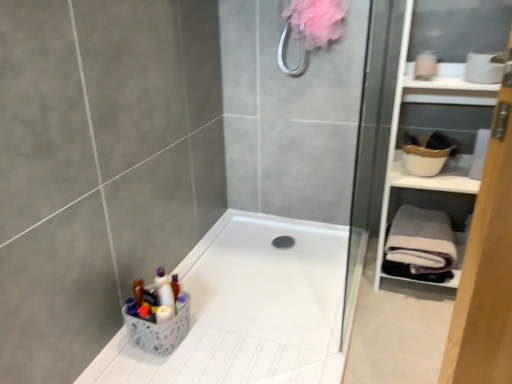
This screenshot has width=512, height=384. In order to click on free space to the right of white plastic basket at lower left in this screenshot , I will do `click(220, 326)`.